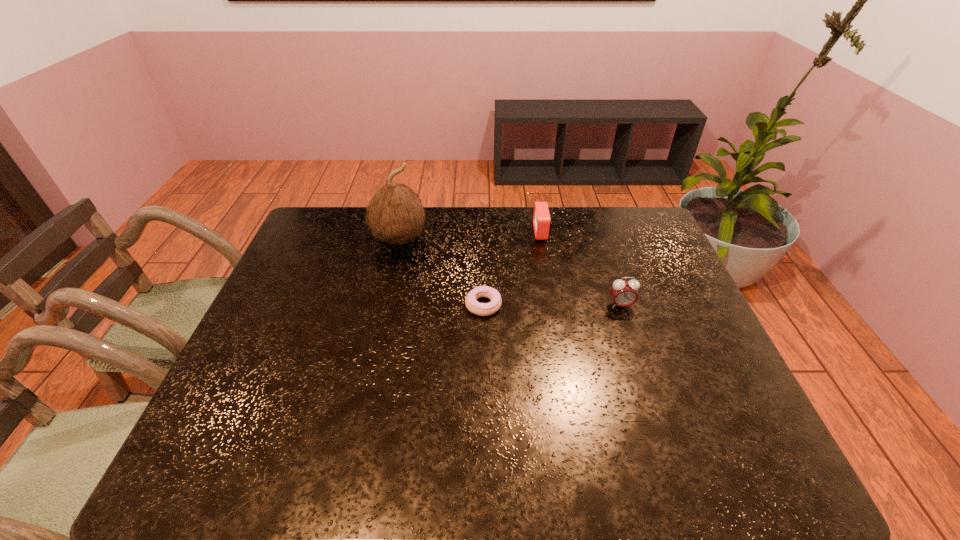
Image resolution: width=960 pixels, height=540 pixels. Identify the location of free spot between the left alarm clock and the rightmost object. (581, 268).

Locate an element on the screen. Image resolution: width=960 pixels, height=540 pixels. free point between the second object from right to left and the leftmost object is located at coordinates (470, 235).

Locate an element on the screen. This screenshot has height=540, width=960. free space between the leftmost object and the shorter alarm clock is located at coordinates (470, 235).

Image resolution: width=960 pixels, height=540 pixels. I want to click on object that can be found as the second closest to the rightmost object, so click(x=542, y=223).

Locate which object ranks third in proximity to the right alarm clock. Please provide its 2D coordinates. Your answer should be formatted as a tuple, i.e. [(x, y)], where the tuple contains the x and y coordinates of a point satisfying the conditions above.

[(395, 213)]

Identify the location of blank area in the image that satisfies the following two spatial constraints: 1. on the front-facing side of the farther alarm clock; 2. on the surface of the tallest object. The height and width of the screenshot is (540, 960). (542, 239).

Identify the location of free spot that satisfies the following two spatial constraints: 1. on the surface of the coconut; 2. on the right side of the doughnut. (385, 305).

The height and width of the screenshot is (540, 960). What are the coordinates of `free spot that satisfies the following two spatial constraints: 1. on the front-facing side of the third tallest object; 2. on the surface of the coconut` in the screenshot? It's located at (542, 239).

At what (x,y) coordinates should I click in order to perform the action: click on vacant space that satisfies the following two spatial constraints: 1. on the surface of the third object from right to left; 2. on the right side of the coconut. Please return your answer as a coordinate pair (x, y). Image resolution: width=960 pixels, height=540 pixels. Looking at the image, I should click on (385, 305).

Identify the location of blank space that satisfies the following two spatial constraints: 1. on the front-facing side of the farther alarm clock; 2. on the surface of the coconut. (542, 239).